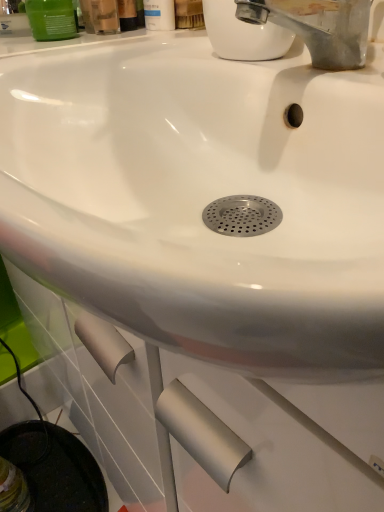
At what (x,y) coordinates should I click in order to perform the action: click on vacant space to the right of green matte container at upper left, the 1th mouthwash positioned from the left. Please return your answer as a coordinate pair (x, y). The height and width of the screenshot is (512, 384). Looking at the image, I should click on (167, 41).